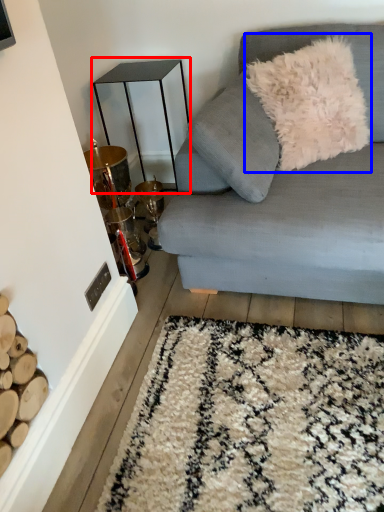
Question: Which of the following is the closest to the observer, table (highlighted by a red box) or throw pillow (highlighted by a blue box)?

Choices:
 (A) table
 (B) throw pillow

Answer: (B)